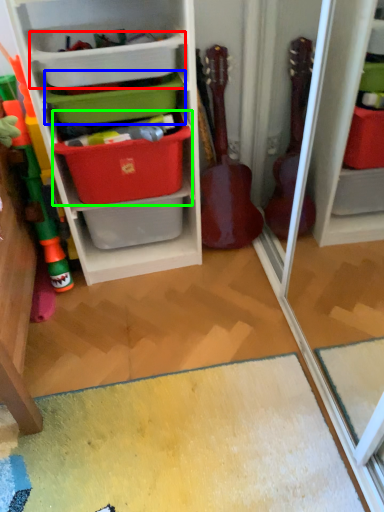
Question: Estimate the real-world distances between objects in this image. Which object is closer to storage box (highlighted by a red box), storage box (highlighted by a blue box) or storage box (highlighted by a green box)?

Choices:
 (A) storage box
 (B) storage box

Answer: (A)